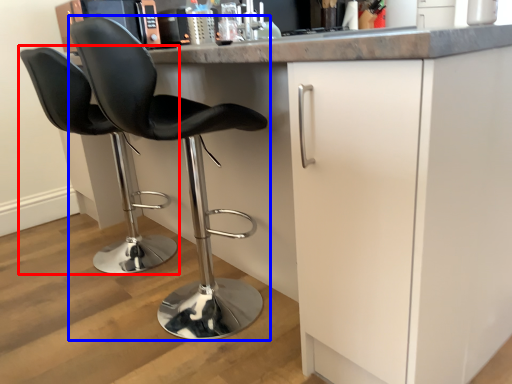
Question: Which object is closer to the camera taking this photo, chair (highlighted by a red box) or chair (highlighted by a blue box)?

Choices:
 (A) chair
 (B) chair

Answer: (B)